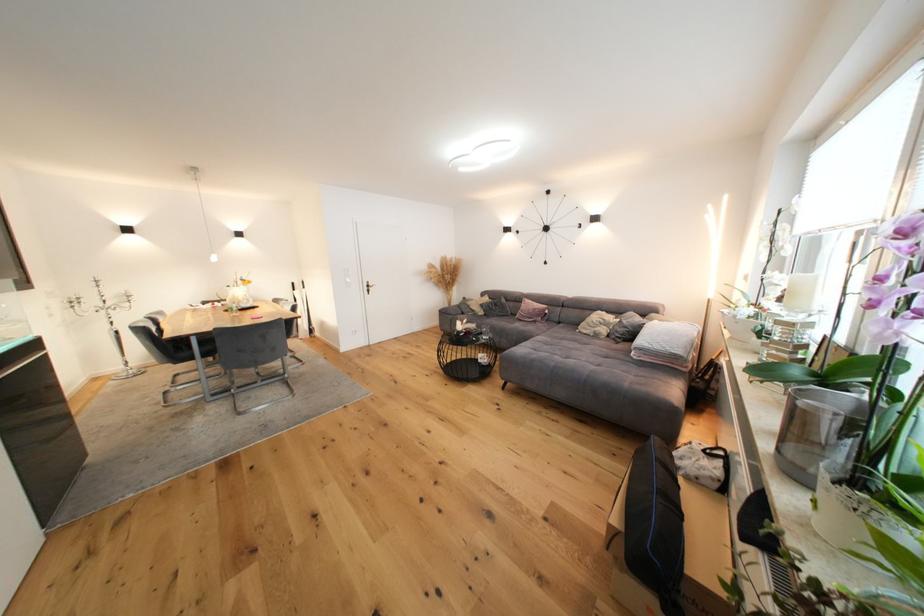
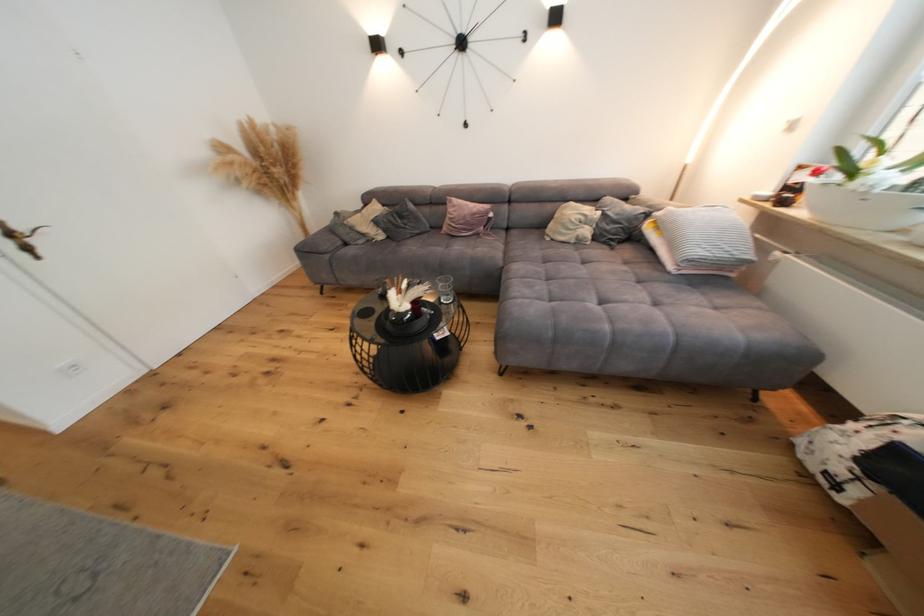
In the second image, find the point that corresponds to pixel 470 313 in the first image.

(354, 240)